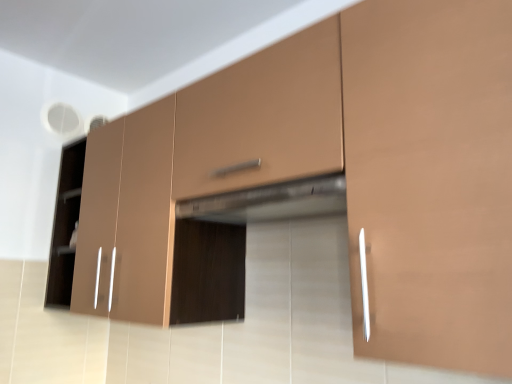
Question: Is satin metallic exhaust hood at center taller than matte brown cabinet at center, the second cabinetry when ordered from front to back?

Choices:
 (A) yes
 (B) no

Answer: (B)

Question: Does satin metallic exhaust hood at center appear on the left side of matte brown cabinet at center, the second cabinetry when ordered from front to back?

Choices:
 (A) no
 (B) yes

Answer: (A)

Question: Does satin metallic exhaust hood at center have a larger size compared to matte brown cabinet at center, the second cabinetry when ordered from front to back?

Choices:
 (A) no
 (B) yes

Answer: (A)

Question: Is satin metallic exhaust hood at center positioned far away from matte brown cabinet at center, the second cabinetry when ordered from front to back?

Choices:
 (A) no
 (B) yes

Answer: (A)

Question: Is matte brown cabinet at center, the 2th cabinetry from the right, a part of satin metallic exhaust hood at center?

Choices:
 (A) yes
 (B) no

Answer: (B)

Question: Based on their sizes in the image, would you say matte brown cabinet at center, which is the 1th cabinetry from back to front, is bigger or smaller than matte brown drawer at center?

Choices:
 (A) small
 (B) big

Answer: (B)

Question: Do you think matte brown cabinet at center, arranged as the first cabinetry when viewed from the left, is within matte brown drawer at center, or outside of it?

Choices:
 (A) inside
 (B) outside

Answer: (B)

Question: Is matte brown cabinet at center, arranged as the first cabinetry when viewed from the left, taller or shorter than matte brown drawer at center?

Choices:
 (A) short
 (B) tall

Answer: (B)

Question: Considering their positions, is matte brown cabinet at center, the second cabinetry when ordered from front to back, located in front of or behind matte brown drawer at center?

Choices:
 (A) behind
 (B) front

Answer: (A)

Question: In terms of size, does matte brown cabinet at right, the first cabinetry in the front-to-back sequence, appear bigger or smaller than matte brown cabinet at center, which is the 1th cabinetry from back to front?

Choices:
 (A) big
 (B) small

Answer: (B)

Question: Is point (409, 342) positioned closer to the camera than point (103, 129)?

Choices:
 (A) closer
 (B) farther

Answer: (A)

Question: Visually, is matte brown cabinet at right, the second cabinetry viewed from the back, positioned to the left or to the right of matte brown cabinet at center, the second cabinetry when ordered from front to back?

Choices:
 (A) right
 (B) left

Answer: (A)

Question: Is matte brown cabinet at right, the second cabinetry viewed from the back, wider or thinner than matte brown cabinet at center, the second cabinetry when ordered from front to back?

Choices:
 (A) thin
 (B) wide

Answer: (A)

Question: From the image's perspective, is matte brown drawer at center located above or below matte brown cabinet at right, the second cabinetry viewed from the back?

Choices:
 (A) below
 (B) above

Answer: (B)

Question: In terms of height, does matte brown drawer at center look taller or shorter compared to matte brown cabinet at right, the 2th cabinetry positioned from the left?

Choices:
 (A) short
 (B) tall

Answer: (A)